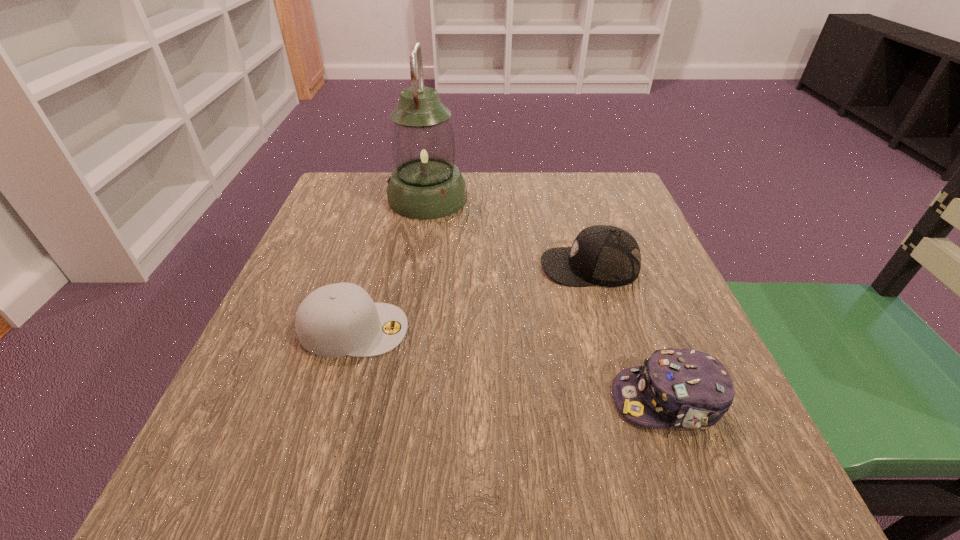
In order to click on blank space at the right edge of the desktop in this screenshot , I will do `click(674, 289)`.

The width and height of the screenshot is (960, 540). In the image, there is a desktop. Find the location of `vacant space at the far left corner`. vacant space at the far left corner is located at coordinates (378, 210).

Image resolution: width=960 pixels, height=540 pixels. What are the coordinates of `free space at the near left corner of the desktop` in the screenshot? It's located at (240, 510).

At what (x,y) coordinates should I click in order to perform the action: click on free space at the far right corner. Please return your answer as a coordinate pair (x, y). Looking at the image, I should click on (630, 190).

Locate an element on the screen. This screenshot has height=540, width=960. blank region between the third nearest object and the lantern is located at coordinates point(509,232).

You are a GUI agent. You are given a task and a screenshot of the screen. Output one action in this format:
    pyautogui.click(x=<x>, y=<y>)
    Task: Click on the free space between the leftmost headwear and the nearest headwear
    Image resolution: width=960 pixels, height=540 pixels.
    Given the screenshot: What is the action you would take?
    click(511, 364)

You are a GUI agent. You are given a task and a screenshot of the screen. Output one action in this format:
    pyautogui.click(x=<x>, y=<y>)
    Task: Click on the empty location between the lantern and the nearest object
    Image resolution: width=960 pixels, height=540 pixels.
    Given the screenshot: What is the action you would take?
    pyautogui.click(x=548, y=299)

The width and height of the screenshot is (960, 540). In order to click on free space between the nearest headwear and the lantern in this screenshot , I will do `click(548, 299)`.

Where is `empty space between the farthest headwear and the farthest object`? The height and width of the screenshot is (540, 960). empty space between the farthest headwear and the farthest object is located at coordinates (509, 232).

Identify the location of unoccupied area between the lantern and the third nearest object. The image size is (960, 540). (509, 232).